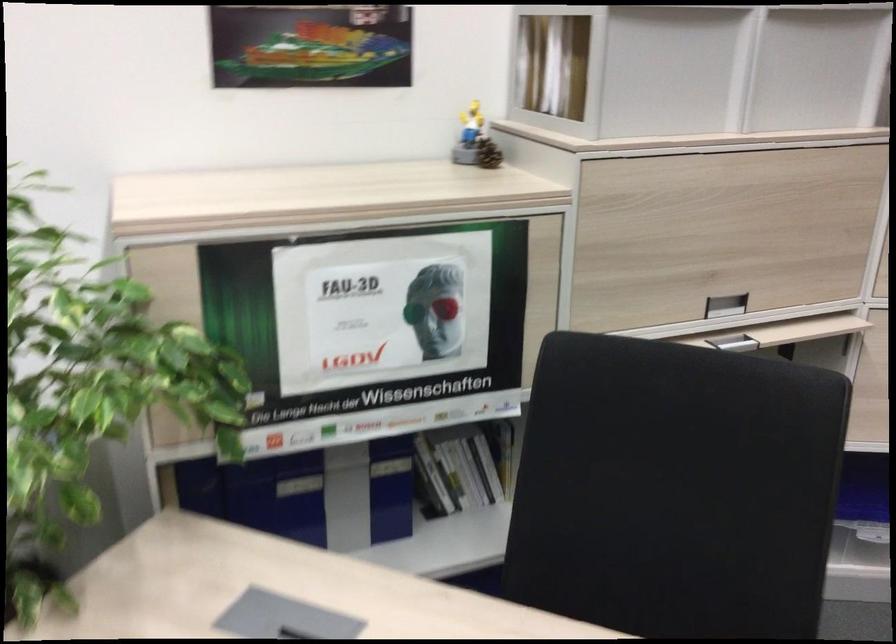
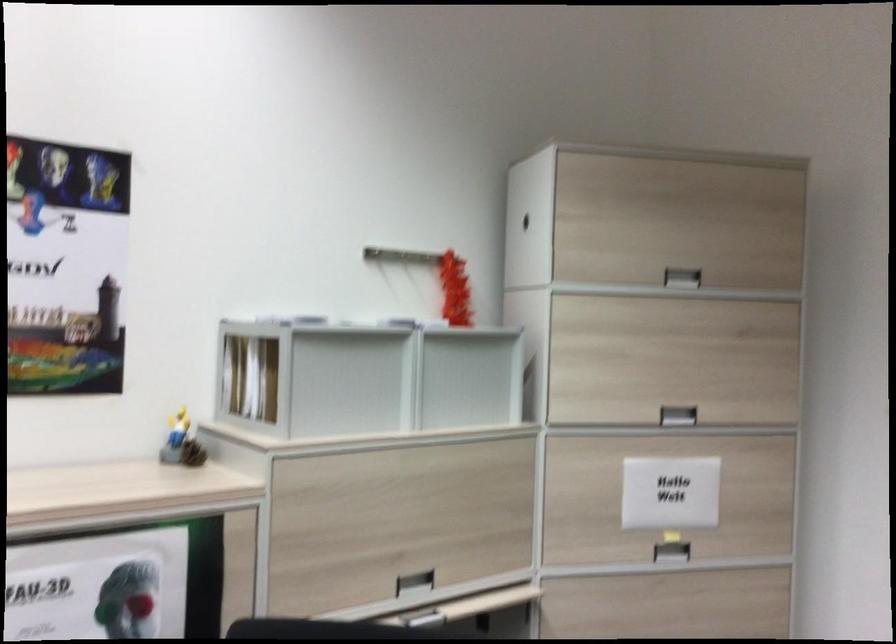
Which direction would the cameraman need to move to produce the second image?

The movement direction of the cameraman is right, backward.